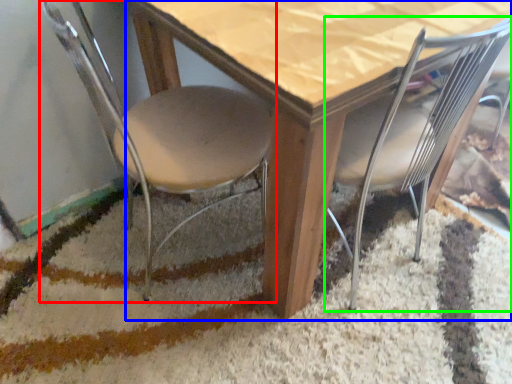
Question: Which object is positioned closest to chair (highlighted by a red box)? Select from table (highlighted by a blue box) and chair (highlighted by a green box).

Choices:
 (A) table
 (B) chair

Answer: (A)